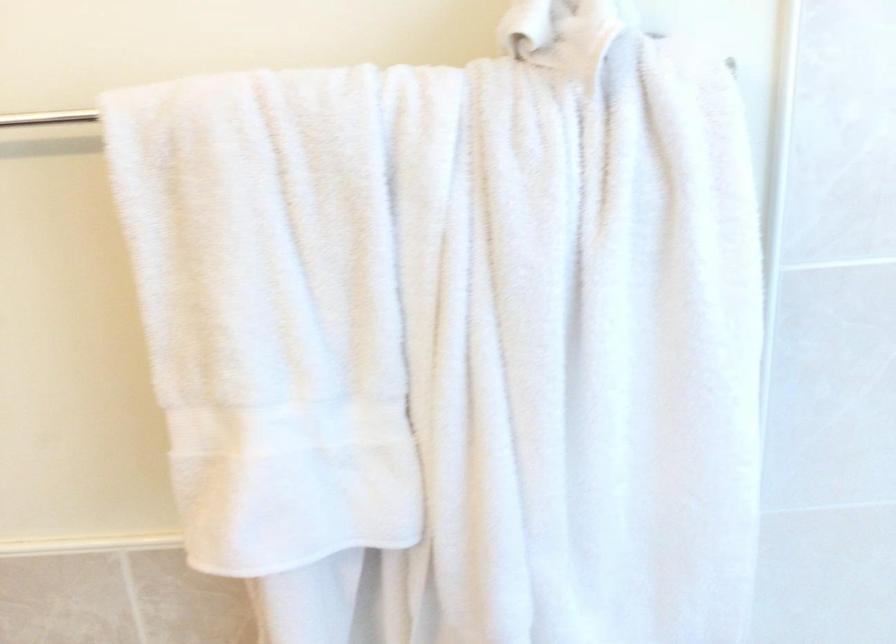
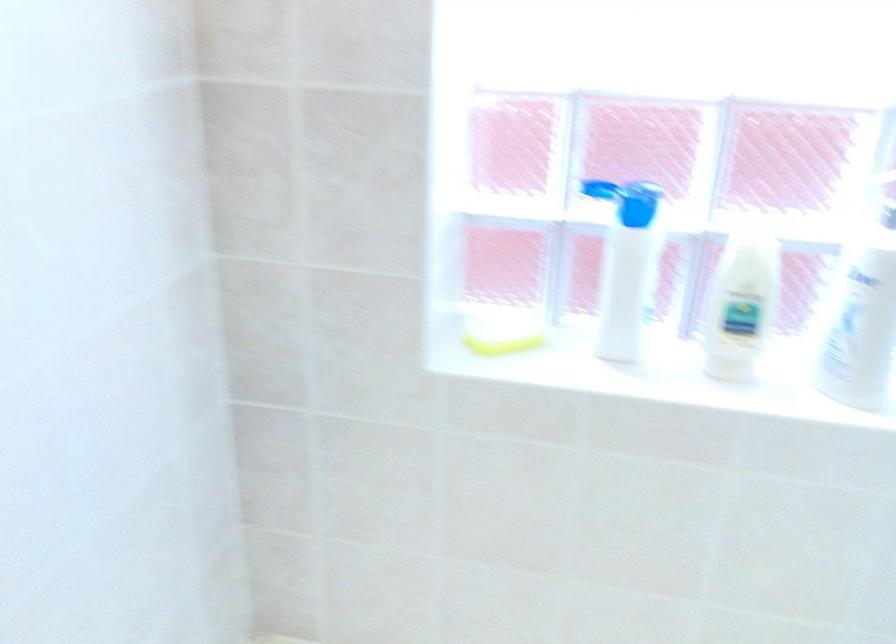
Question: The camera is either moving clockwise (left) or counter-clockwise (right) around the object. The first image is from the beginning of the video and the second image is from the end. Is the camera moving left or right when shooting the video?

Choices:
 (A) Left
 (B) Right

Answer: (A)